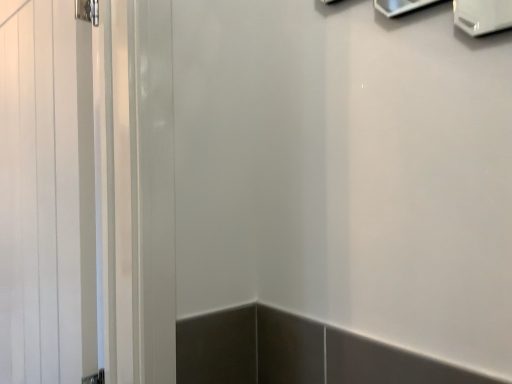
What do you see at coordinates (46, 195) in the screenshot? The image size is (512, 384). I see `white glossy door at left` at bounding box center [46, 195].

I want to click on white glossy door at left, so click(46, 195).

Measure the distance between white glossy door at left and camera.

white glossy door at left is 34.76 inches away from camera.

You are a GUI agent. You are given a task and a screenshot of the screen. Output one action in this format:
    pyautogui.click(x=<x>, y=<y>)
    Task: Click on the white glossy door at left
    This screenshot has height=384, width=512.
    Given the screenshot: What is the action you would take?
    pyautogui.click(x=46, y=195)